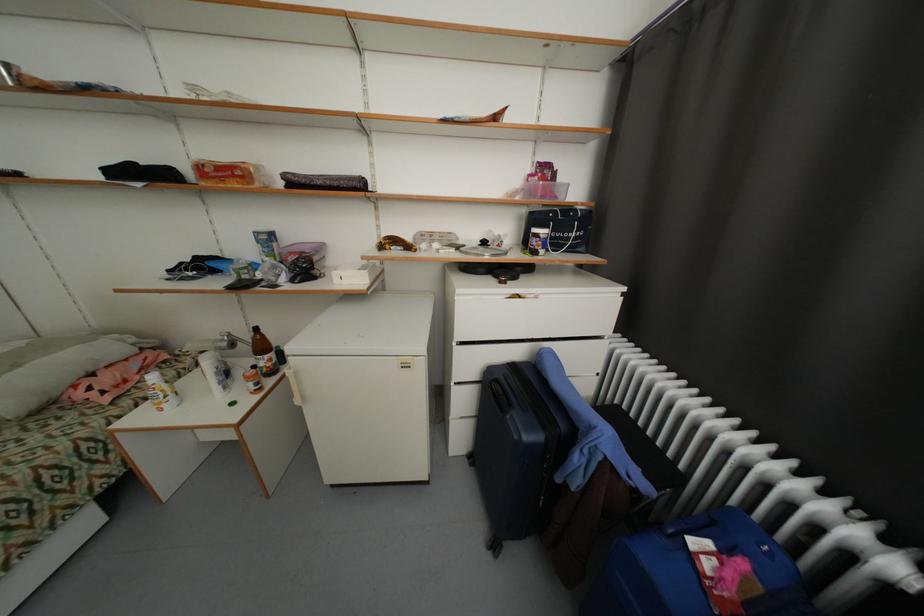
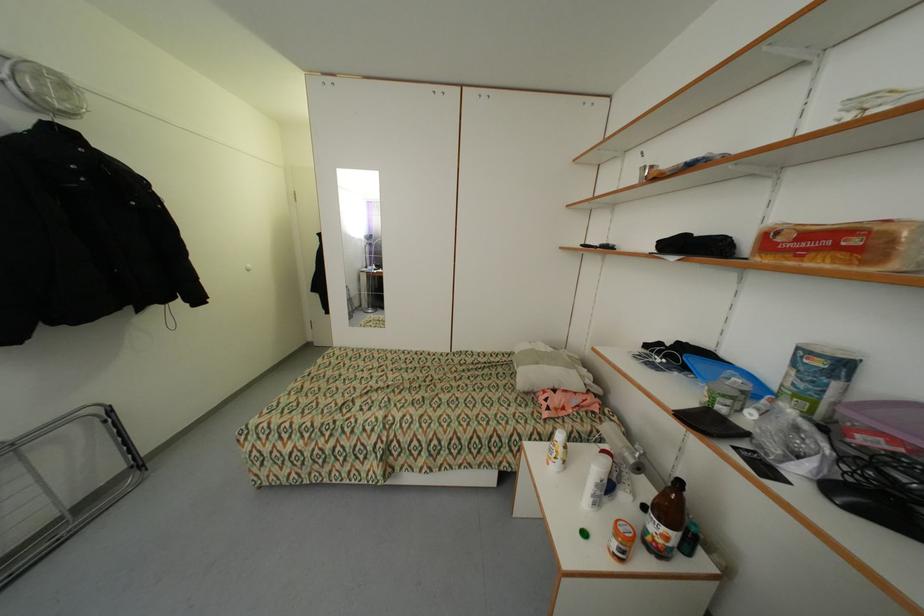
Where in the second image is the point corresponding to the point at 232,345 from the first image?

(638, 462)